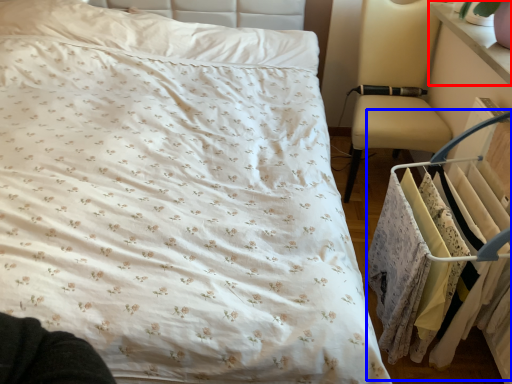
Question: Which of the following is the closest to the observer, changing table (highlighted by a red box) or closet (highlighted by a blue box)?

Choices:
 (A) changing table
 (B) closet

Answer: (B)